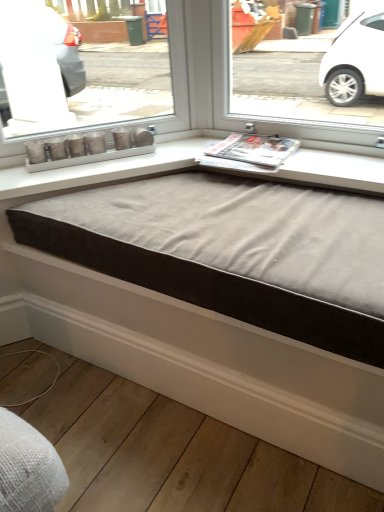
This screenshot has height=512, width=384. In order to click on free point above white wood baseboard at lower center (from a real-world perspective) in this screenshot , I will do `click(129, 442)`.